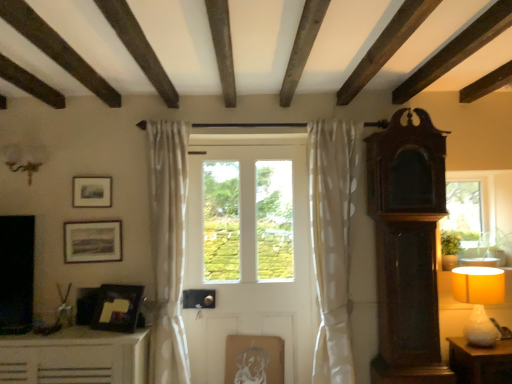
Question: From their relative heights in the image, would you say matte glass sconce at upper left is taller or shorter than white matte door at center?

Choices:
 (A) short
 (B) tall

Answer: (A)

Question: Which is correct: matte glass sconce at upper left is inside white matte door at center, or outside of it?

Choices:
 (A) inside
 (B) outside

Answer: (B)

Question: Estimate the real-world distances between objects in this image. Which object is closer to the white sheer curtain at center, arranged as the second curtain when viewed from the left?

Choices:
 (A) matte wooden picture frame at center, which appears as the 4th picture frame when viewed from the left
 (B) matte wooden picture frame at upper left, which appears as the 3th picture frame when ordered from the bottom
 (C) matte black picture frame at lower left, the 3th picture frame in the left-to-right sequence
 (D) matte yellow fabric lampshade at right
 (E) white sheer curtain at left, which is the first curtain in left-to-right order

Answer: (A)

Question: Which object is the farthest from the white sheer curtain at center, arranged as the second curtain when viewed from the left?

Choices:
 (A) dark wood grandfather clock at right
 (B) white matte door at center
 (C) white sheer curtain at left, arranged as the second curtain when viewed from the right
 (D) matte wooden picture frame at upper left, positioned as the 3th picture frame in right-to-left order
 (E) matte black picture frame at lower left, which is counted as the 2th picture frame, starting from the bottom

Answer: (D)